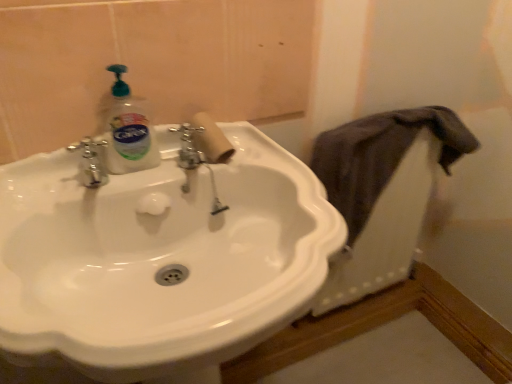
Question: Is white glossy sink at center not near dark gray fabric at right?

Choices:
 (A) no
 (B) yes

Answer: (A)

Question: Considering the relative sizes of white glossy sink at center and dark gray fabric at right in the image provided, is white glossy sink at center smaller than dark gray fabric at right?

Choices:
 (A) yes
 (B) no

Answer: (B)

Question: From the image's perspective, is white glossy sink at center located above dark gray fabric at right?

Choices:
 (A) yes
 (B) no

Answer: (B)

Question: Does white glossy sink at center contain dark gray fabric at right?

Choices:
 (A) yes
 (B) no

Answer: (B)

Question: Is white glossy sink at center facing towards dark gray fabric at right?

Choices:
 (A) yes
 (B) no

Answer: (B)

Question: From a real-world perspective, relative to white glossy sink at center, is dark gray fabric at right vertically above or below?

Choices:
 (A) below
 (B) above

Answer: (B)

Question: Is point (369, 157) closer or farther from the camera than point (58, 175)?

Choices:
 (A) farther
 (B) closer

Answer: (A)

Question: Is dark gray fabric at right in front of or behind white glossy sink at center in the image?

Choices:
 (A) behind
 (B) front

Answer: (A)

Question: In terms of height, does dark gray fabric at right look taller or shorter compared to white glossy sink at center?

Choices:
 (A) tall
 (B) short

Answer: (B)

Question: Considering their positions, is dark gray fabric at right located in front of or behind white cardboard toilet paper at center?

Choices:
 (A) front
 (B) behind

Answer: (B)

Question: From a real-world perspective, is dark gray fabric at right physically located above or below white cardboard toilet paper at center?

Choices:
 (A) above
 (B) below

Answer: (B)

Question: Would you say dark gray fabric at right is to the left or to the right of white cardboard toilet paper at center in the picture?

Choices:
 (A) left
 (B) right

Answer: (B)

Question: Considering the positions of point (339, 163) and point (206, 122), is point (339, 163) closer or farther from the camera than point (206, 122)?

Choices:
 (A) closer
 (B) farther

Answer: (B)

Question: From the image's perspective, is white glossy sink at center positioned above or below white cardboard toilet paper at center?

Choices:
 (A) above
 (B) below

Answer: (B)

Question: Choose the correct answer: Is white glossy sink at center inside white cardboard toilet paper at center or outside it?

Choices:
 (A) outside
 (B) inside

Answer: (A)